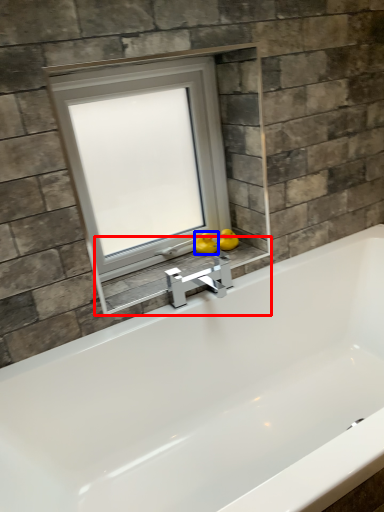
Question: Which of the following is the farthest to the observer, window sill (highlighted by a red box) or duck (highlighted by a blue box)?

Choices:
 (A) window sill
 (B) duck

Answer: (B)